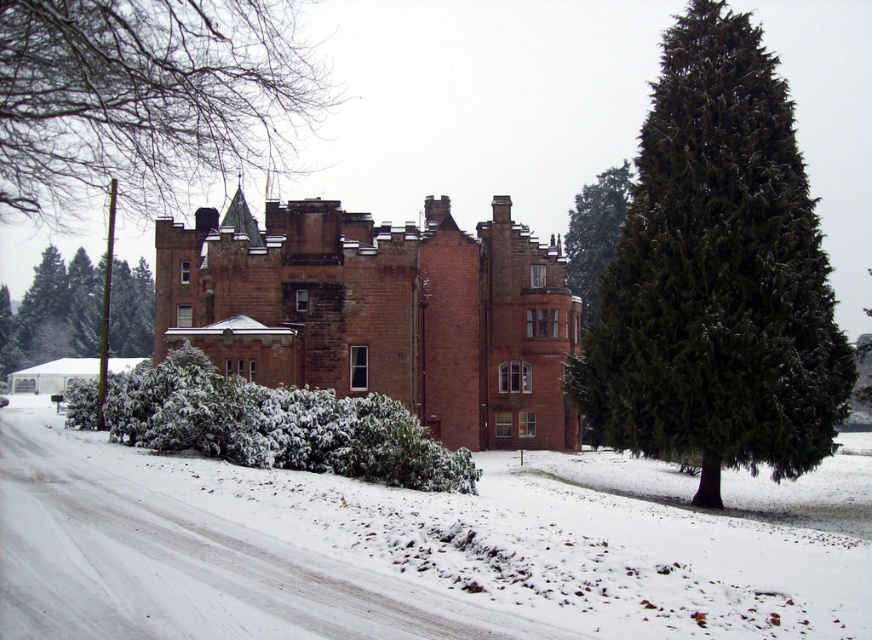
You are a visitor approaching the castle on the snow road. You see the white fluffy snow at center and the green textured tree at upper center. Which object is closer to you as you walk along the road?

The white fluffy snow at center is closer to you because it is positioned under the green textured tree at upper center, meaning the tree is further away.

You are a visitor approaching the castle along the snow road. You notice white fluffy snow at center and green textured tree at upper center. Which of these two elements takes up more visual space in the scene?

The green textured tree at upper center occupies more visual space than the white fluffy snow at center according to the description.